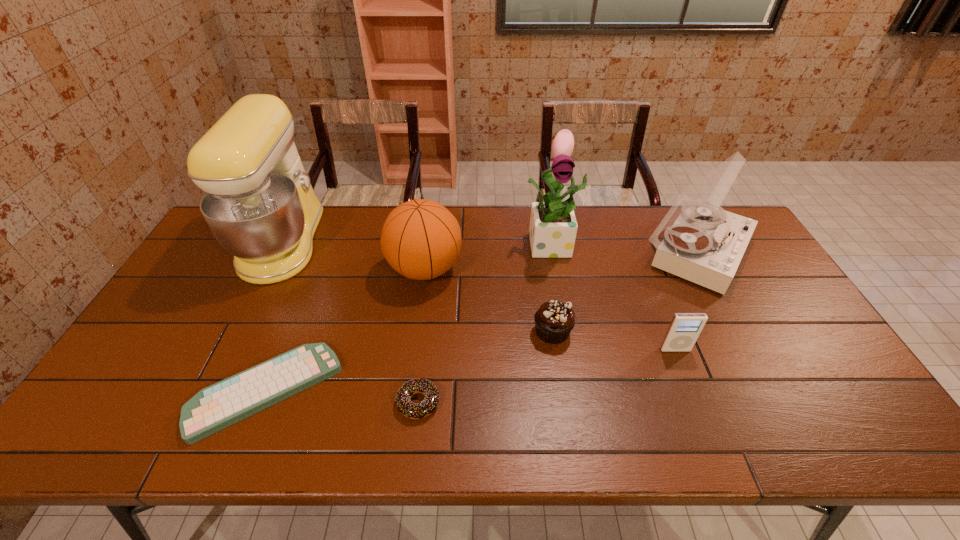
Locate an element on the screen. mixer is located at coordinates (259, 203).

The height and width of the screenshot is (540, 960). I want to click on flower arrangement, so click(x=553, y=227).

Image resolution: width=960 pixels, height=540 pixels. Identify the location of record player. (703, 243).

The image size is (960, 540). I want to click on the fourth tallest object, so click(421, 239).

In order to click on iPod in this screenshot , I will do `click(684, 329)`.

Locate an element on the screen. Image resolution: width=960 pixels, height=540 pixels. the third shortest object is located at coordinates (555, 319).

Image resolution: width=960 pixels, height=540 pixels. I want to click on the seventh tallest object, so 410,410.

The height and width of the screenshot is (540, 960). I want to click on computer keyboard, so click(x=218, y=406).

Find the location of a particular element. This screenshot has height=540, width=960. vacant space located 0.280m on the side of the mixer with the control knob is located at coordinates (406, 242).

Locate an element on the screen. Image resolution: width=960 pixels, height=540 pixels. free space located on the front-facing side of the flower arrangement is located at coordinates (564, 299).